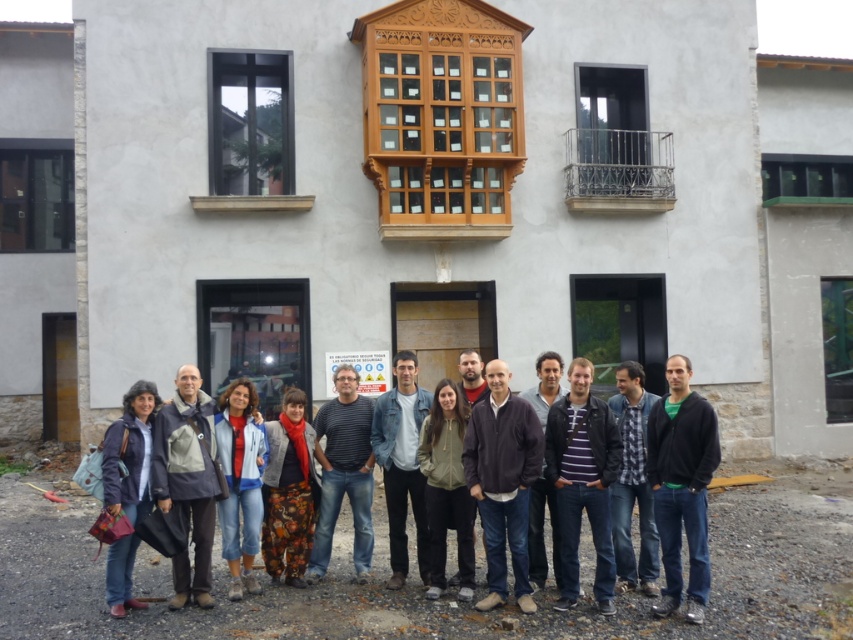
In the scene shown: You are a photographer trying to capture a clear photo of the group. You notice the black matte jacket at center and the blue denim jeans at center. Since the jacket is larger, which clothing item might be more likely to block the view of someone behind it?

The black matte jacket at center has a larger size compared to the blue denim jeans at center, so the black matte jacket at center is more likely to block the view of someone behind it.

You are a photographer trying to capture a group photo of the people in front of the building. You notice two individuals wearing a striped cotton shirt at center and a floral fabric dress at center. Since they are both at the center, can you determine which one is closer to the camera?

The striped cotton shirt at center is 11.74 inches away from the floral fabric dress at center, but without knowing the direction of the distance, it is impossible to determine which is closer to the camera.

You are a photographer setting up for a group photo. You notice a black matte jacket at center at point (682,484). Can you place a marker at that point to ensure the jacket remains in the frame?

Yes, placing a marker at point (682,484) will ensure the black matte jacket at center stays in the frame as it is located exactly at that coordinate.